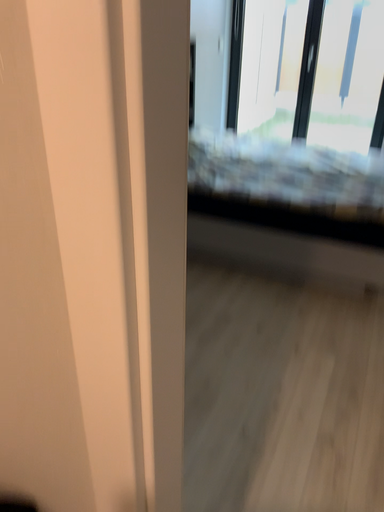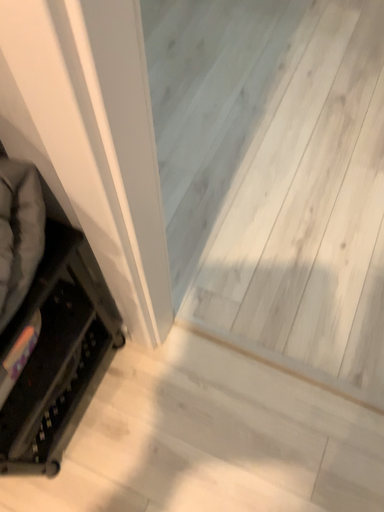
Question: Which way did the camera rotate in the video?

Choices:
 (A) rotated downward
 (B) rotated upward

Answer: (A)